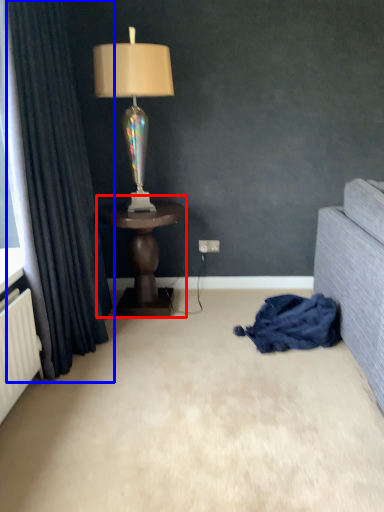
Question: Which point is closer to the camera, table (highlighted by a red box) or curtain (highlighted by a blue box)?

Choices:
 (A) table
 (B) curtain

Answer: (B)